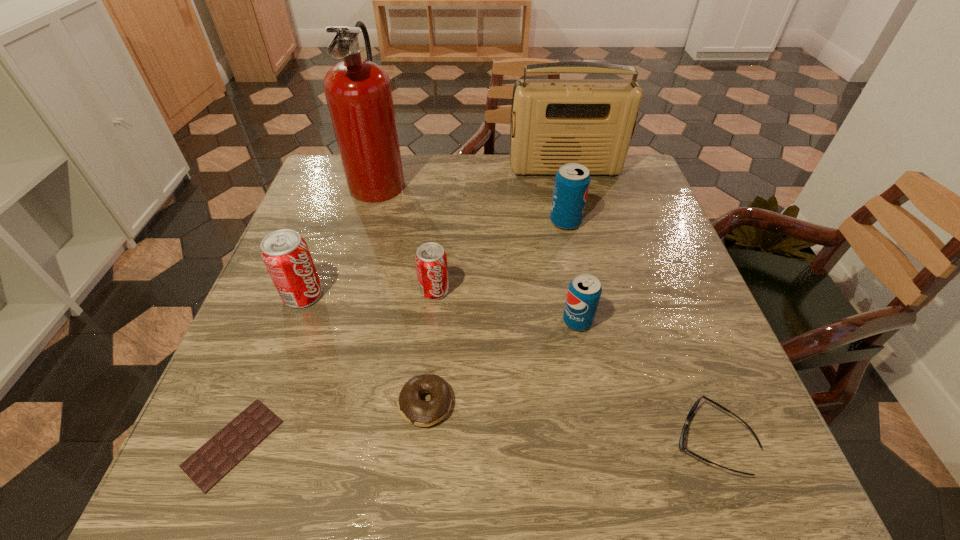
The width and height of the screenshot is (960, 540). Identify the location of fire extinguisher at the left edge. (358, 92).

Where is `soda can situated at the left edge`? The width and height of the screenshot is (960, 540). soda can situated at the left edge is located at coordinates (286, 256).

Find the location of `chocolate bar present at the left edge`. chocolate bar present at the left edge is located at coordinates (218, 456).

The image size is (960, 540). I want to click on radio receiver that is positioned at the right edge, so click(591, 122).

Image resolution: width=960 pixels, height=540 pixels. I want to click on sunglasses that is at the right edge, so click(x=681, y=442).

Find the location of a particular element. object that is at the far left corner is located at coordinates (358, 92).

Identify the location of object that is at the near left corner. The height and width of the screenshot is (540, 960). (218, 456).

Locate an element on the screen. Image resolution: width=960 pixels, height=540 pixels. object that is at the far right corner is located at coordinates [x=591, y=122].

Find the location of `object at the near right corner`. object at the near right corner is located at coordinates (681, 442).

Where is `vacant space at the far edge of the desktop`? vacant space at the far edge of the desktop is located at coordinates (425, 153).